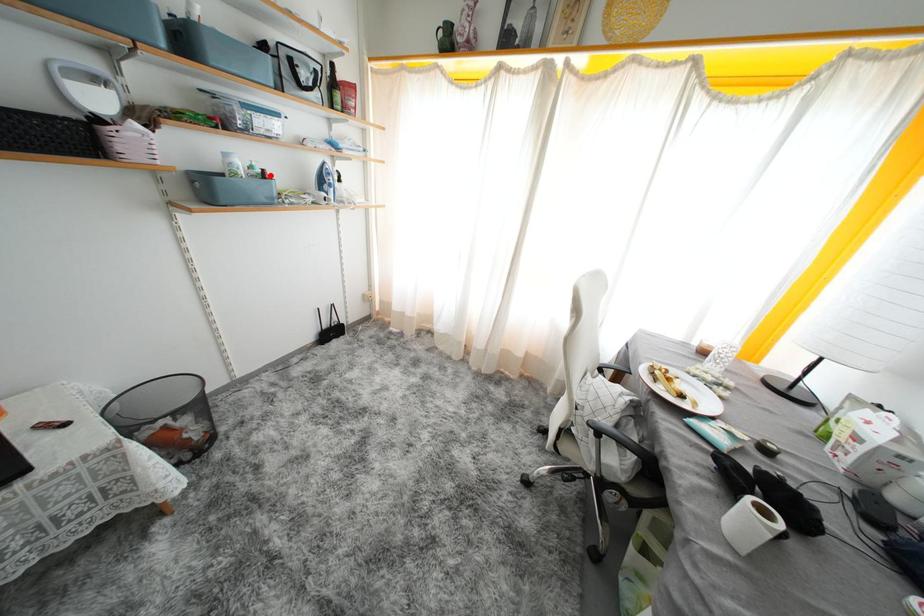
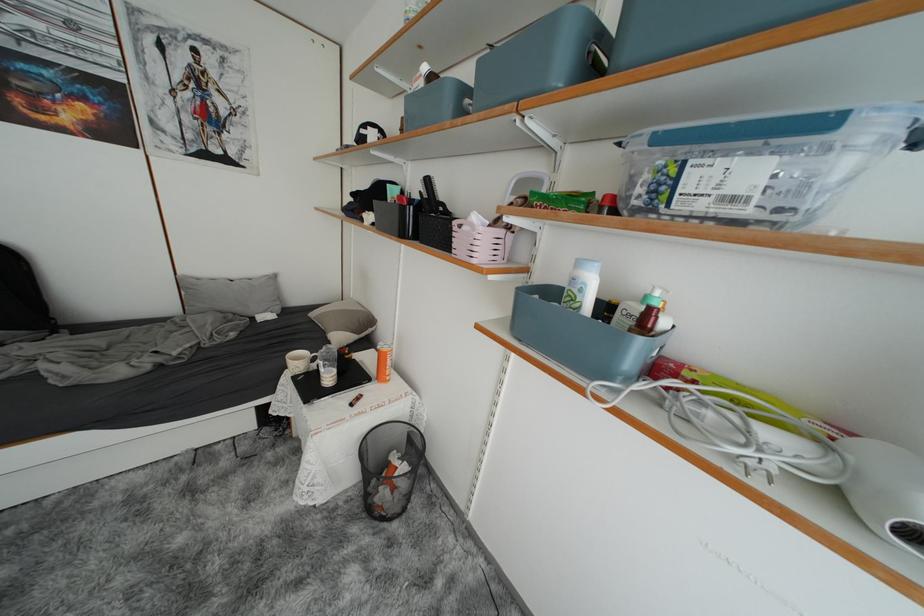
Where in the second image is the point corresponding to the highlighted location from the first image?

(657, 315)